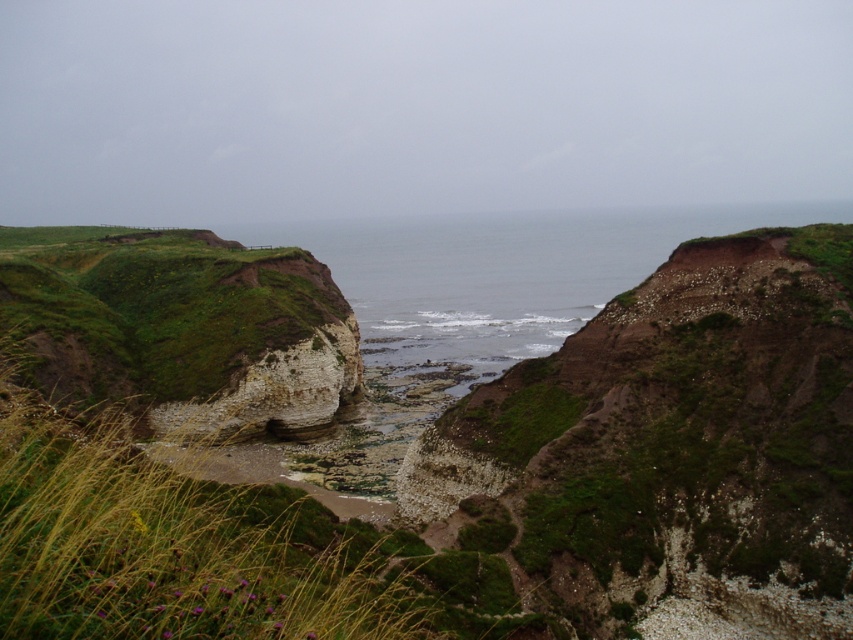
In the scene shown: You are a hiker standing at the base of the white limestone cliff at center and want to reach the green mossy rock at left. Which direction should you move to get there?

The green mossy rock at left is in front of the white limestone cliff at center, so you should move forward towards the direction of the green mossy rock at left to reach it.

You are a hiker standing at the base of the white limestone cliff at center and want to reach the green mossy hillside at center. Given that your maximum comfortable walking distance is 150 feet, can you safely make the journey without needing rest?

The green mossy hillside at center is 148.96 feet away from the white limestone cliff at center. Since this distance is just under your 150 feet limit, you can safely make the journey without needing rest.